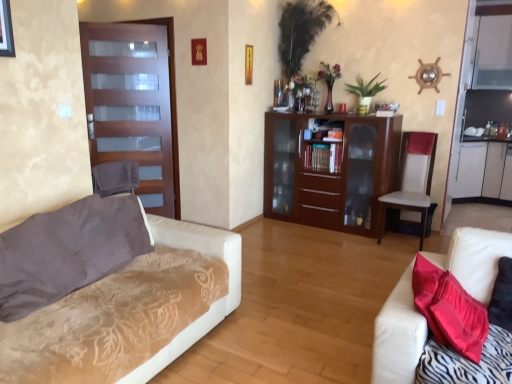
Question: From a real-world perspective, is metallic gold picture frame at upper center, the first picture frame when ordered from right to left, physically located above or below brown wood cabinet at center?

Choices:
 (A) above
 (B) below

Answer: (A)

Question: Considering the positions of metallic gold picture frame at upper center, the first picture frame when ordered from right to left, and brown wood cabinet at center in the image, is metallic gold picture frame at upper center, the first picture frame when ordered from right to left, taller or shorter than brown wood cabinet at center?

Choices:
 (A) short
 (B) tall

Answer: (A)

Question: Which object is the farthest from the green glossy vase at upper center?

Choices:
 (A) white leather chair at right
 (B) white textured couch at left, which ranks as the 1th studio couch in left-to-right order
 (C) wooden picture frame at upper center, which is the first picture frame in left-to-right order
 (D) brown wood cabinet at center
 (E) velvet brown pillow at left

Answer: (E)

Question: Considering the real-world distances, which object is farthest from the wooden picture frame at upper center, the 2th picture frame positioned from the back?

Choices:
 (A) matte glass door at left
 (B) white textured couch at left, which ranks as the 1th studio couch in left-to-right order
 (C) metallic gold picture frame at upper center, the first picture frame when ordered from right to left
 (D) brown wood cabinet at center
 (E) white leather chair at right

Answer: (B)